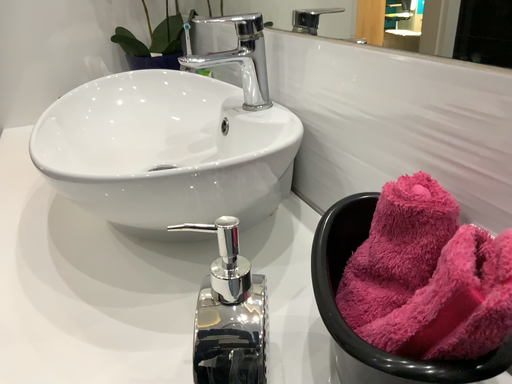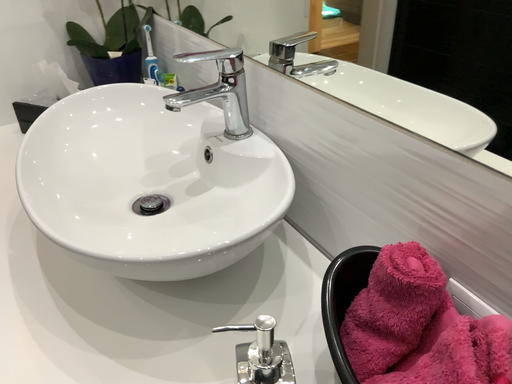
Question: Which way did the camera rotate in the video?

Choices:
 (A) rotated right
 (B) rotated left

Answer: (A)